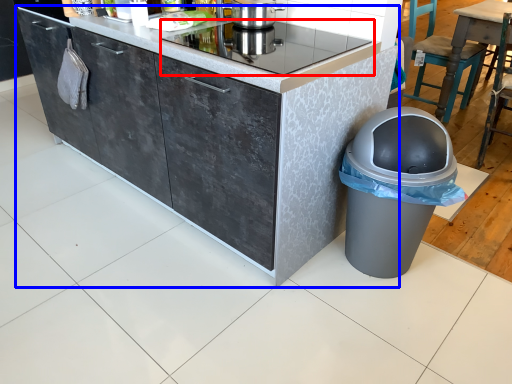
Question: Which point is further to the camera, home appliance (highlighted by a red box) or cabinetry (highlighted by a blue box)?

Choices:
 (A) home appliance
 (B) cabinetry

Answer: (A)